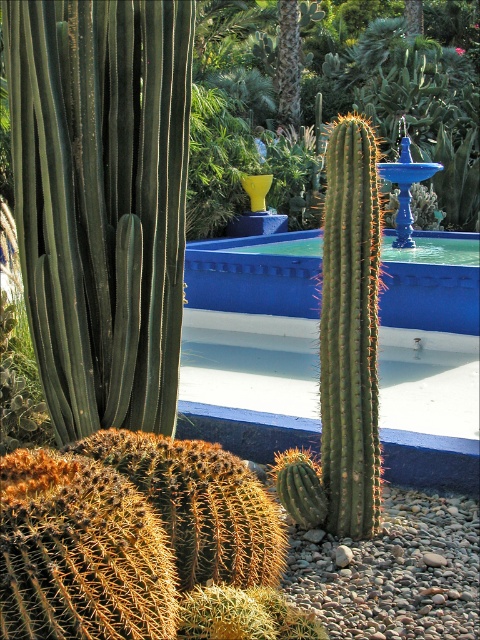
You are planning to place a new small statue in the garden. The statue is 1 meter tall. You want to place it near the green spiny cactus at center and the blue smooth pool at center. Which object should you place it closer to so that it doesn

The green spiny cactus at center is larger in size than the blue smooth pool at center. Therefore, you should place the statue closer to the blue smooth pool at center to avoid overshadowing the larger cactus.

Based on the coordinates provided, where exactly is the green spiny cactus at center located in the image?

The green spiny cactus at center is located at point coordinates of (405, 86).

You are designing a garden layout and want to place a new decorative statue between the green spiny cactus at center and the blue smooth pool at center. Considering their widths, which object will require more space horizontally for the statue placement?

The green spiny cactus at center has a greater width than the blue smooth pool at center, so placing the statue between them would require more space horizontally to accommodate the wider cactus.